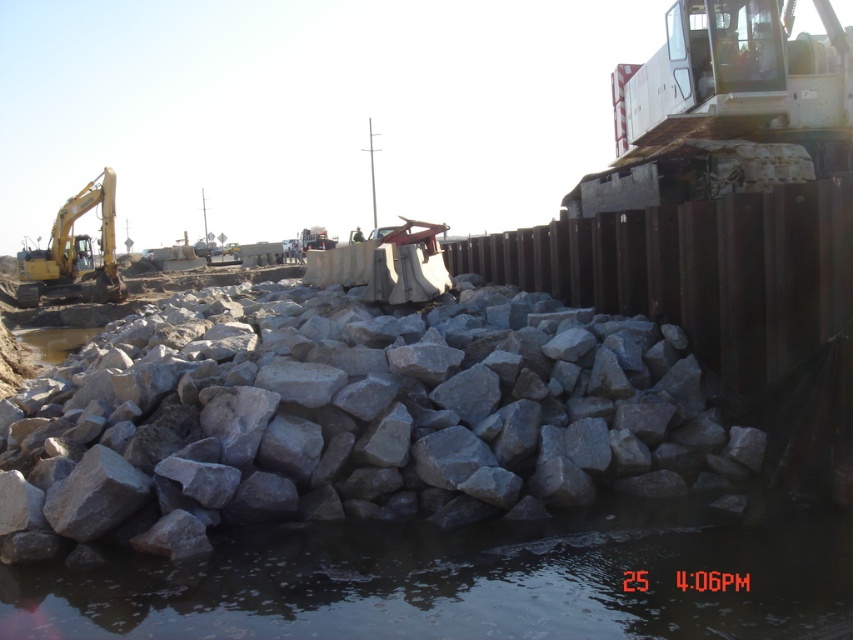
Question: Does clear water at lower center appear under yellow metallic excavator at left?

Choices:
 (A) yes
 (B) no

Answer: (A)

Question: Which point is closer to the camera?

Choices:
 (A) gray rough stone at center
 (B) yellow metallic excavator at left
 (C) clear water at lower center

Answer: (C)

Question: Which point is closer to the camera?

Choices:
 (A) (73, 237)
 (B) (686, 381)
 (C) (384, 625)

Answer: (C)

Question: Does gray rough stone at center appear on the left side of yellow metallic excavator at left?

Choices:
 (A) yes
 (B) no

Answer: (B)

Question: Which of these objects is positioned farthest from the clear water at lower center?

Choices:
 (A) yellow metallic excavator at left
 (B) gray rough stone at center

Answer: (A)

Question: Is gray rough stone at center smaller than clear water at lower center?

Choices:
 (A) no
 (B) yes

Answer: (B)